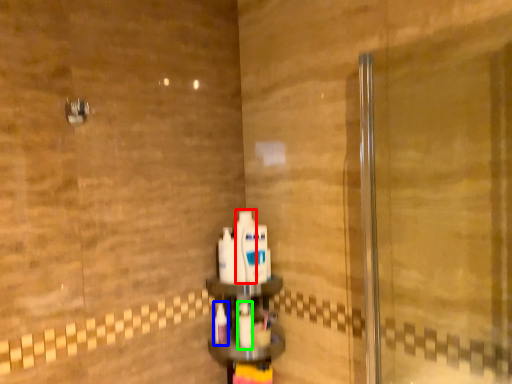
Question: Which is nearer to the mouthwash (highlighted by a red box)? toothbrush (highlighted by a blue box) or mouthwash (highlighted by a green box).

Choices:
 (A) toothbrush
 (B) mouthwash

Answer: (B)